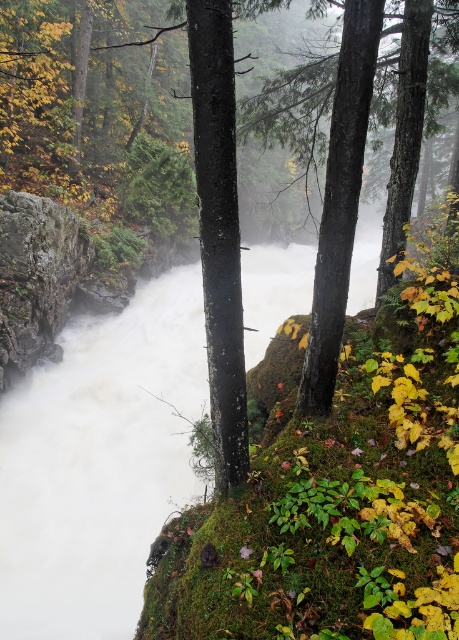
Is point (332, 113) in front of point (419, 77)?

Yes, point (332, 113) is in front of point (419, 77).

Between point (364, 51) and point (410, 83), which one is positioned in front?

Positioned in front is point (364, 51).

Who is more distant from viewer, (341, 99) or (379, 275)?

The point (379, 275) is more distant.

Locate an element on the screen. This screenshot has height=640, width=459. smooth bark tree at center is located at coordinates (340, 202).

Is the position of smooth black tree trunk at center more distant than that of green rough bark tree at center?

No, it is in front of green rough bark tree at center.

Is smooth black tree trunk at center closer to camera compared to green rough bark tree at center?

Yes, it is.

The image size is (459, 640). In order to click on smooth black tree trunk at center in this screenshot , I will do (x=218, y=230).

How much distance is there between smooth black tree trunk at center and smooth bark tree at center?

34.77 inches

Can you confirm if smooth black tree trunk at center is smaller than smooth bark tree at center?

No, smooth black tree trunk at center is not smaller than smooth bark tree at center.

Is point (242, 326) behind point (325, 406)?

No, (242, 326) is closer to viewer.

In order to click on smooth black tree trunk at center in this screenshot , I will do `click(218, 230)`.